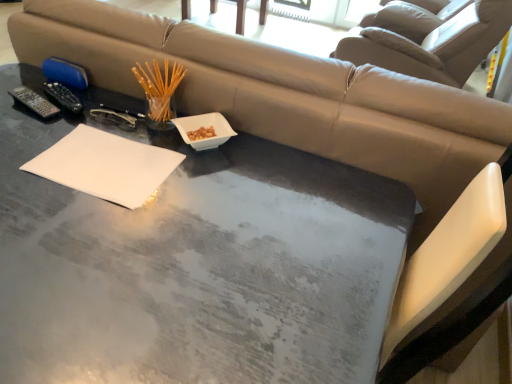
This screenshot has height=384, width=512. Find the location of `free location to the left of black plastic remote at left`. free location to the left of black plastic remote at left is located at coordinates (7, 99).